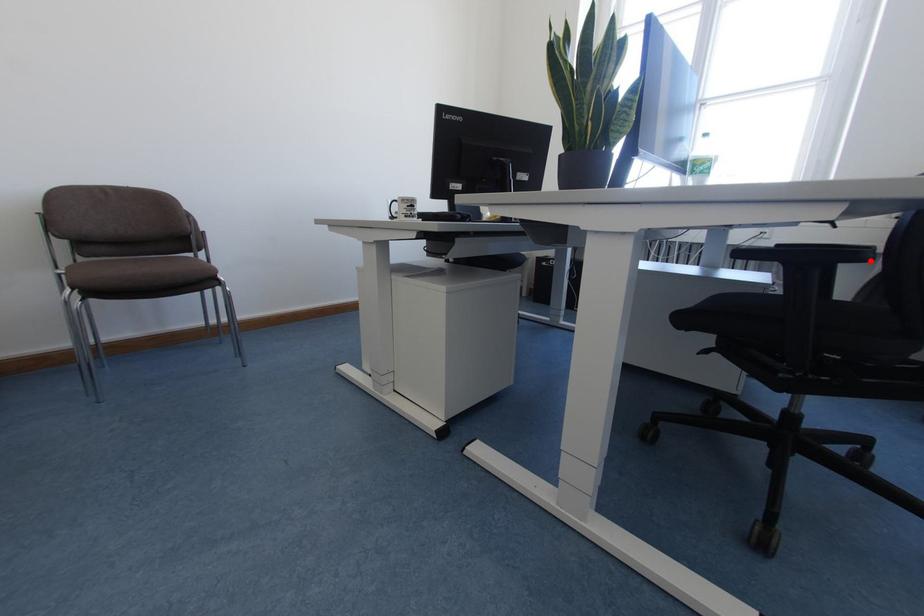
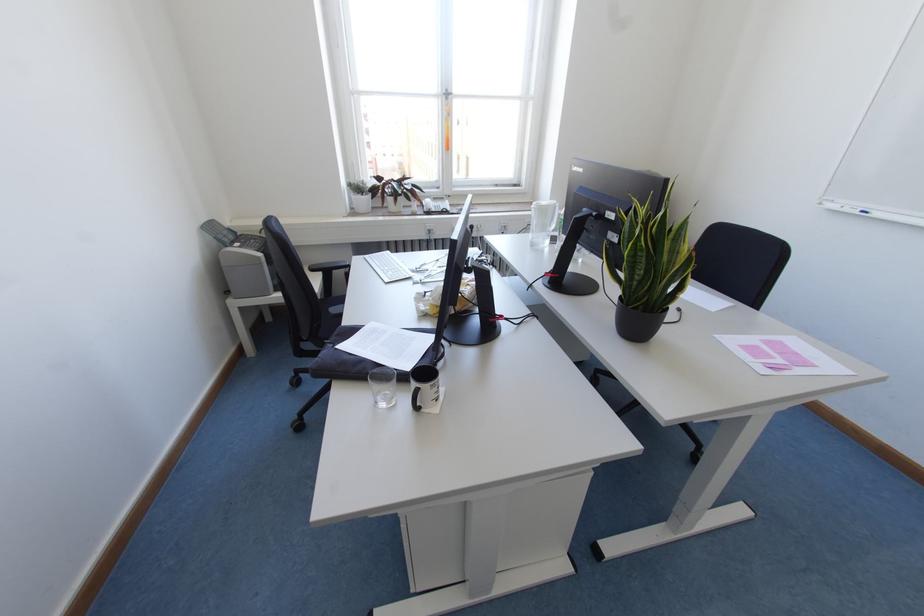
Question: I am providing you with two images of the same scene from different viewpoints. A red point is marked on the first image. Can you still see the location of the red point in image 2?

Choices:
 (A) Yes
 (B) No

Answer: (B)